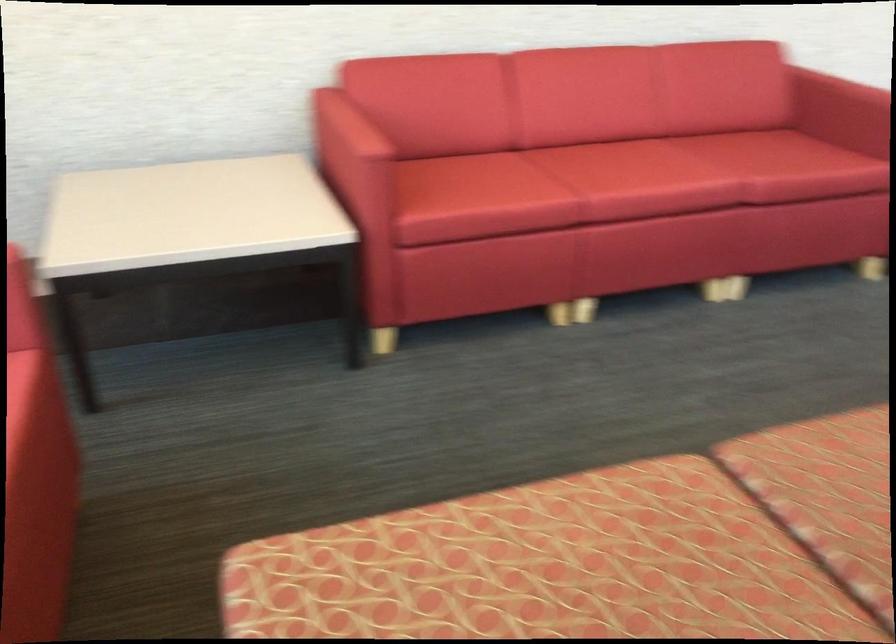
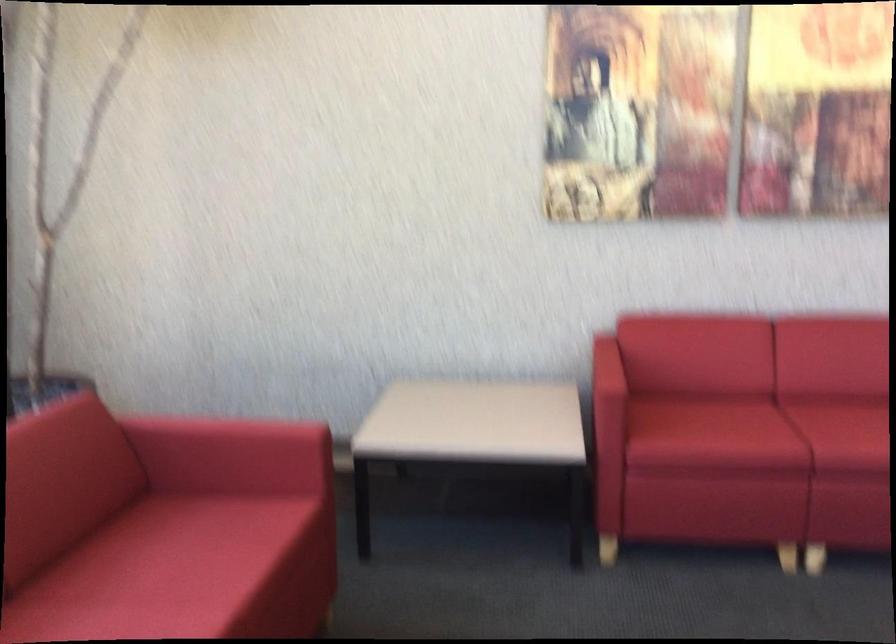
Question: How did the camera likely rotate?

Choices:
 (A) Left
 (B) Right
 (C) Up
 (D) Down

Answer: (A)